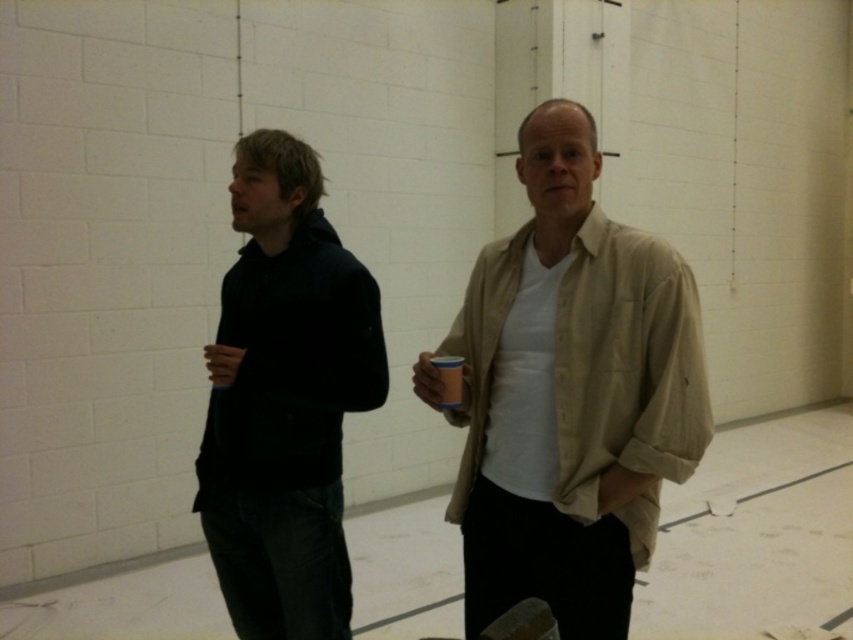
Question: Among these points, which one is nearest to the camera?

Choices:
 (A) (538, 570)
 (B) (239, 150)

Answer: (A)

Question: Does beige cotton shirt at center have a smaller size compared to dark blue hoodie at left?

Choices:
 (A) no
 (B) yes

Answer: (A)

Question: Observing the image, what is the correct spatial positioning of beige cotton shirt at center in reference to dark blue hoodie at left?

Choices:
 (A) above
 (B) below

Answer: (A)

Question: Which point is farther to the camera?

Choices:
 (A) (288, 378)
 (B) (457, 502)

Answer: (A)

Question: Is beige cotton shirt at center positioned before dark blue hoodie at left?

Choices:
 (A) no
 (B) yes

Answer: (B)